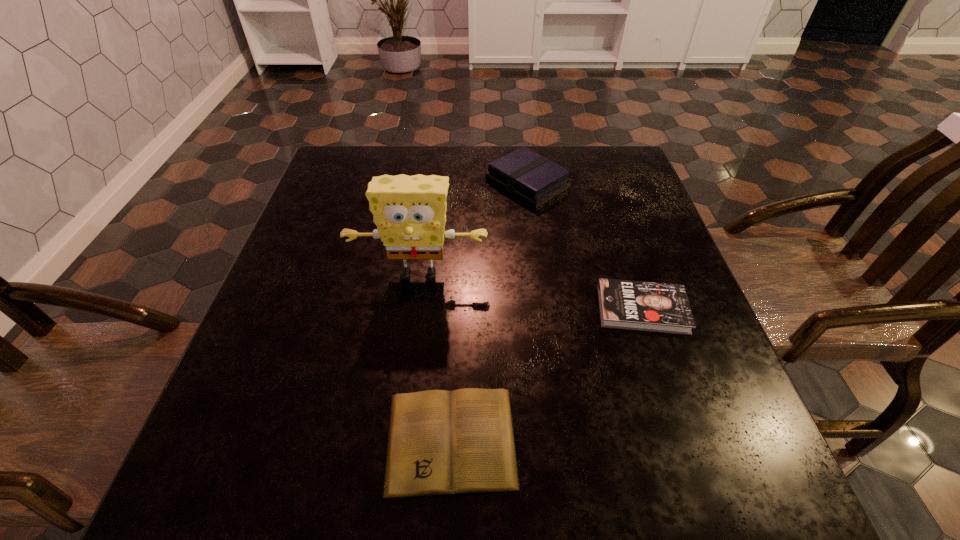
In order to click on free spot located on the back of the shortest object in this screenshot , I will do click(x=459, y=283).

Find the location of `object present at the far edge`. object present at the far edge is located at coordinates (534, 179).

Where is `object that is at the near edge`? The height and width of the screenshot is (540, 960). object that is at the near edge is located at coordinates (440, 442).

At what (x,y) coordinates should I click in order to perform the action: click on object at the left edge. Please return your answer as a coordinate pair (x, y). This screenshot has height=540, width=960. Looking at the image, I should click on (409, 211).

At what (x,y) coordinates should I click in order to perform the action: click on object at the right edge. Please return your answer as a coordinate pair (x, y). Looking at the image, I should click on (633, 305).

In the image, there is a desktop. Identify the location of vacant space at the far edge. (391, 169).

This screenshot has width=960, height=540. In the image, there is a desktop. What are the coordinates of `free space at the left edge` in the screenshot? It's located at (300, 321).

Where is `vacant region at the right edge of the desktop`? This screenshot has height=540, width=960. vacant region at the right edge of the desktop is located at coordinates (697, 388).

In the image, there is a desktop. Identify the location of vacant space at the far left corner. The image size is (960, 540). (338, 163).

At what (x,y) coordinates should I click in order to perform the action: click on vacant space at the near left corner. Please return your answer as a coordinate pair (x, y). This screenshot has height=540, width=960. Looking at the image, I should click on (232, 490).